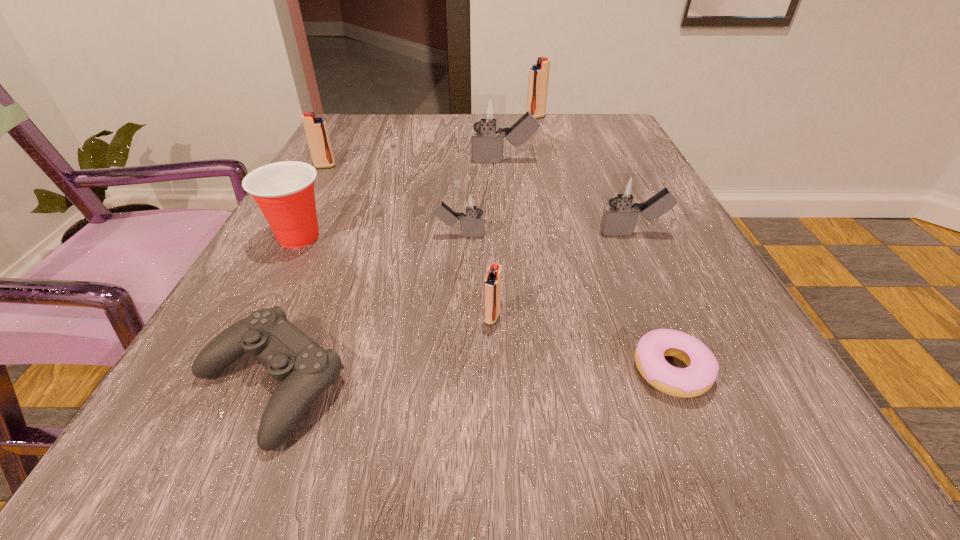
The height and width of the screenshot is (540, 960). I want to click on the smallest gray igniter, so click(472, 203).

The height and width of the screenshot is (540, 960). In order to click on the second shortest object in this screenshot , I will do `click(305, 370)`.

Image resolution: width=960 pixels, height=540 pixels. Find the location of `gray control`. gray control is located at coordinates (305, 370).

I want to click on doughnut, so click(702, 369).

The image size is (960, 540). What are the coordinates of `pink doughnut` in the screenshot? It's located at (702, 369).

Where is `vacant region located on the right of the rightmost red igniter`? The height and width of the screenshot is (540, 960). vacant region located on the right of the rightmost red igniter is located at coordinates 571,117.

At what (x,y) coordinates should I click in order to perform the action: click on vacant point located 0.110m on the right of the farthest gray igniter. Please return your answer as a coordinate pair (x, y). The width and height of the screenshot is (960, 540). Looking at the image, I should click on (585, 161).

This screenshot has height=540, width=960. Find the location of `vacant point located 0.120m on the front of the rightmost gray igniter`. vacant point located 0.120m on the front of the rightmost gray igniter is located at coordinates (659, 292).

Where is `vacant area located on the back of the leftmost igniter`? This screenshot has width=960, height=540. vacant area located on the back of the leftmost igniter is located at coordinates (346, 131).

This screenshot has width=960, height=540. Find the location of `vacant space located 0.050m on the front of the red cup`. vacant space located 0.050m on the front of the red cup is located at coordinates (278, 276).